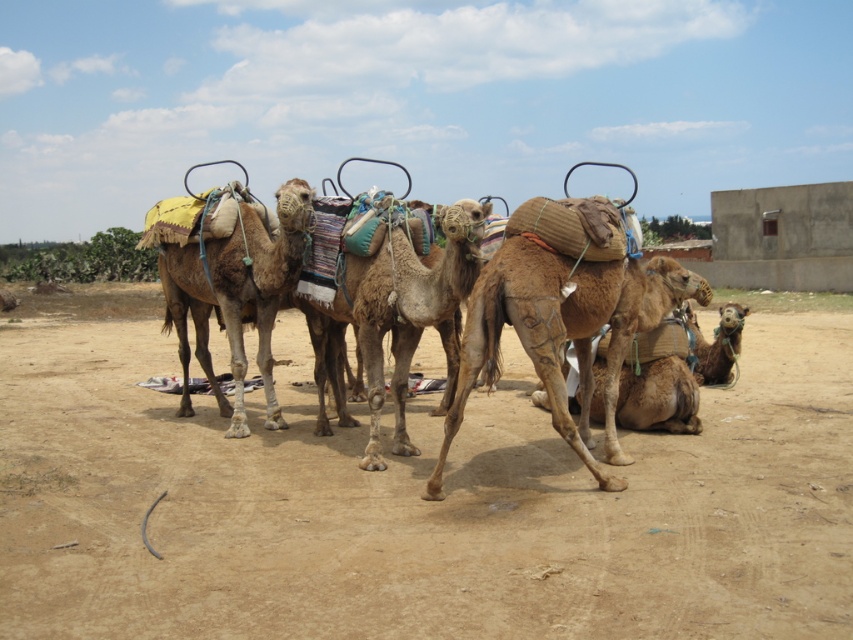
Question: Is brown sandy dirt track at center bigger than brown rough camel at center?

Choices:
 (A) yes
 (B) no

Answer: (A)

Question: Which point is closer to the camera taking this photo?

Choices:
 (A) (418, 268)
 (B) (621, 342)
 (C) (44, 547)

Answer: (C)

Question: Can you confirm if brown textured camel at center is positioned to the left of brown rough camel at center?

Choices:
 (A) yes
 (B) no

Answer: (A)

Question: Which is farther from the brown textured camel at center?

Choices:
 (A) brown rough camel at center
 (B) brown sandy dirt track at center

Answer: (B)

Question: From the image, what is the correct spatial relationship of brown sandy dirt track at center in relation to brown rough camel at center?

Choices:
 (A) below
 (B) above

Answer: (A)

Question: Which object is the closest to the brown rough camel at center?

Choices:
 (A) brown textured camel at center
 (B) brown sandy dirt track at center

Answer: (A)